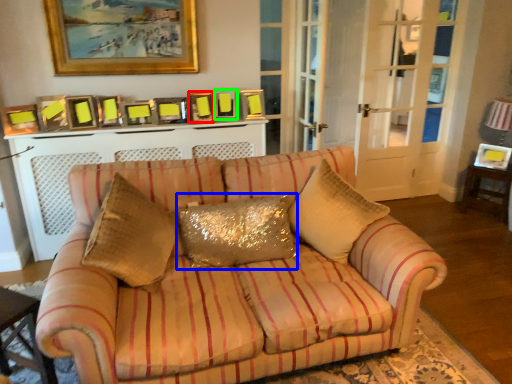
Question: Which object is the farthest from picture frame (highlighted by a red box)? Choose among these: pillow (highlighted by a blue box) or picture frame (highlighted by a green box).

Choices:
 (A) pillow
 (B) picture frame

Answer: (A)